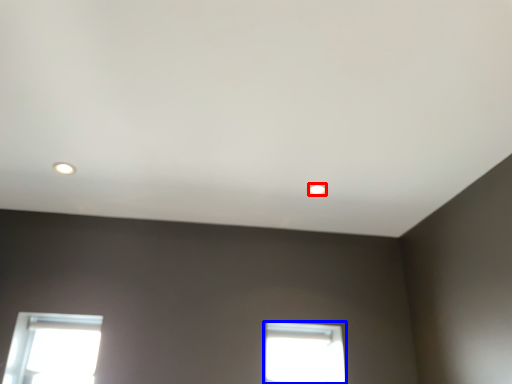
Question: Which point is further to the camera, lighting (highlighted by a red box) or window (highlighted by a blue box)?

Choices:
 (A) lighting
 (B) window

Answer: (B)